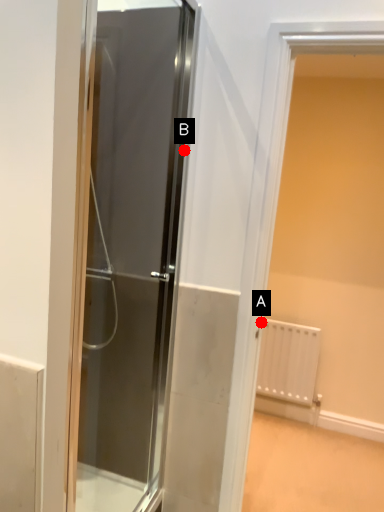
Question: Two points are circled on the image, labeled by A and B beside each circle. Which point is closer to the camera?

Choices:
 (A) A is closer
 (B) B is closer

Answer: (B)